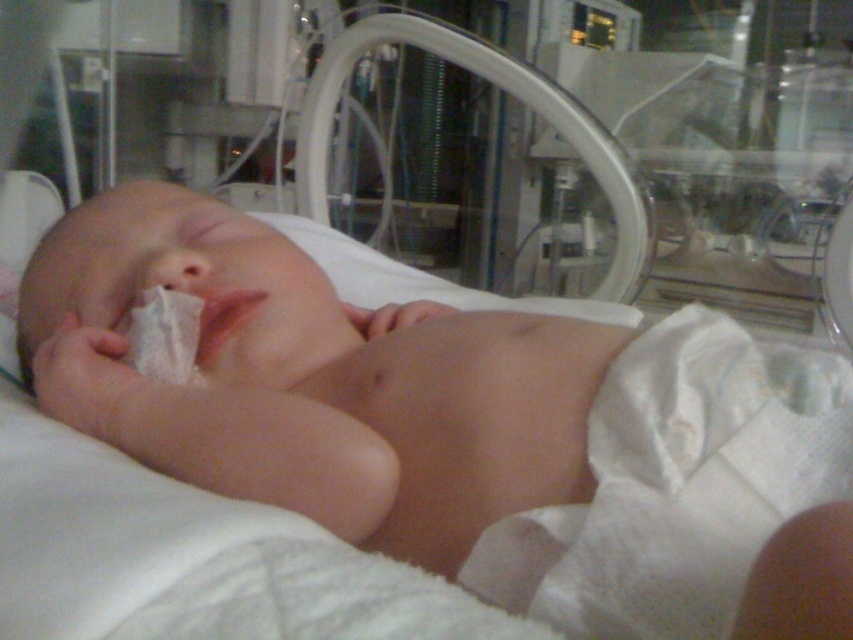
You are a nurse in a hospital. You need to place a medical sensor on the newborn baby. The sensor must be placed outside the area covered by the white cloth diaper at center. Where should you place the sensor?

The white cloth diaper at center is located at point (677,484). To place the sensor outside this area, choose a position not overlapping with the diaper, such as near the baby s chest or legs, ensuring it is secure and does not interfere with the diaper.

You are a nurse checking on a newborn in the hospital. You notice the smooth skin newborn at center and the smooth flesh nose at center. Which one is positioned to the right side?

The smooth skin newborn at center is to the right of the smooth flesh nose at center.

You are a nurse checking on a newborn in the hospital. You notice the smooth skin newborn at center and the smooth flesh nose at center. Which one is positioned lower in the image?

The smooth skin newborn at center is located below the smooth flesh nose at center, so the smooth skin newborn at center is positioned lower in the image.